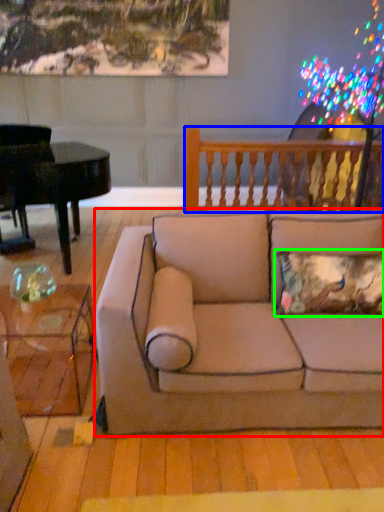
Question: Based on their relative distances, which object is farther from studio couch (highlighted by a red box)? Choose from rail (highlighted by a blue box) and pillow (highlighted by a green box).

Choices:
 (A) rail
 (B) pillow

Answer: (A)